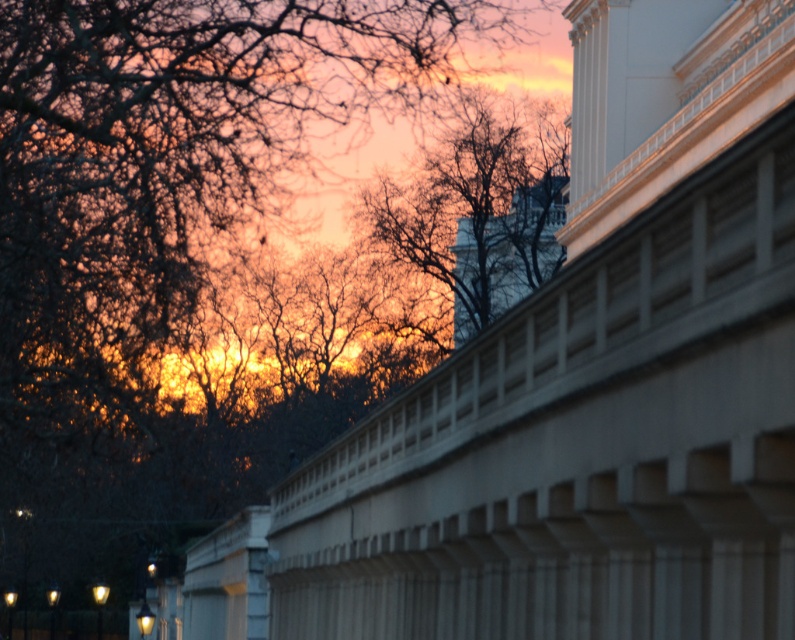
Question: Among these points, which one is nearest to the camera?

Choices:
 (A) pos(148,422)
 (B) pos(534,200)

Answer: (A)

Question: Which object is closer to the camera taking this photo?

Choices:
 (A) brown leafless tree at upper left
 (B) brown textured tree at center

Answer: (A)

Question: Does brown leafless tree at upper left have a smaller size compared to brown textured tree at center?

Choices:
 (A) no
 (B) yes

Answer: (A)

Question: Considering the relative positions of brown leafless tree at upper left and brown textured tree at center in the image provided, where is brown leafless tree at upper left located with respect to brown textured tree at center?

Choices:
 (A) above
 (B) below

Answer: (B)

Question: Is brown leafless tree at upper left further to camera compared to brown textured tree at center?

Choices:
 (A) yes
 (B) no

Answer: (B)